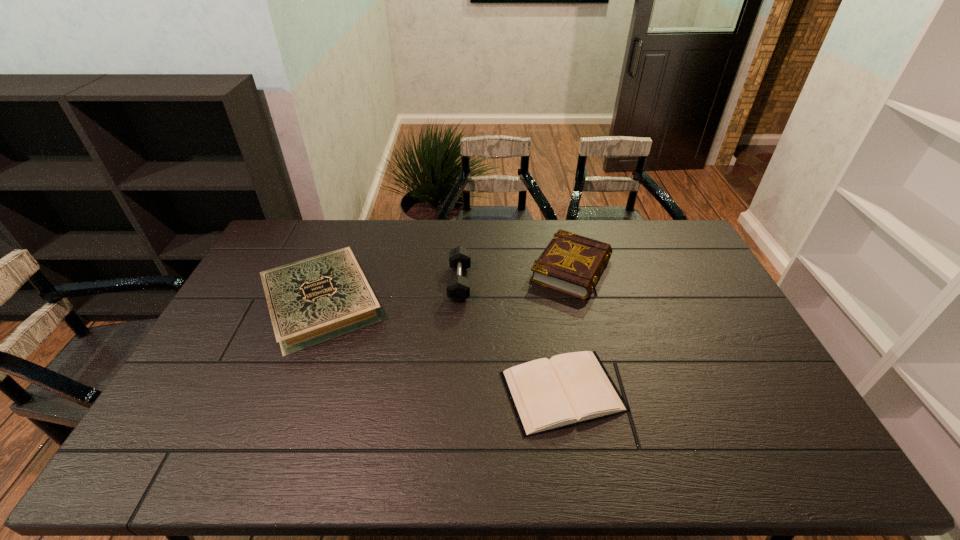
Locate which object is the third closest to the dumbbell. Please provide its 2D coordinates. Your answer should be formatted as a tuple, i.e. [(x, y)], where the tuple contains the x and y coordinates of a point satisfying the conditions above.

[(546, 394)]

What are the coordinates of `hardback book that is the second nearest to the leftmost hardback book` in the screenshot? It's located at (570, 263).

Find the location of a particular element. hardback book object that ranks as the closest to the third object from right to left is located at coordinates (310, 301).

This screenshot has height=540, width=960. What are the coordinates of `blank area in the image that satisfies the following two spatial constraints: 1. on the front side of the leftmost hardback book; 2. on the right side of the shortest object` in the screenshot? It's located at (288, 391).